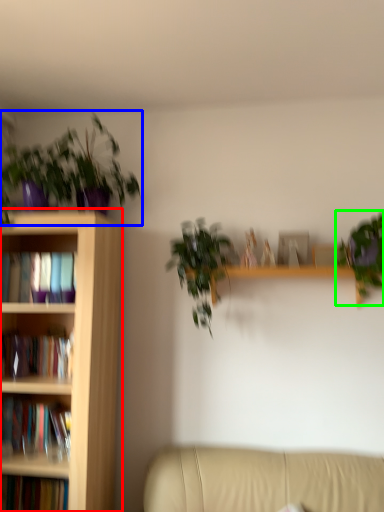
Question: Considering the real-world distances, which object is closest to bookcase (highlighted by a red box)? houseplant (highlighted by a blue box) or houseplant (highlighted by a green box).

Choices:
 (A) houseplant
 (B) houseplant

Answer: (A)